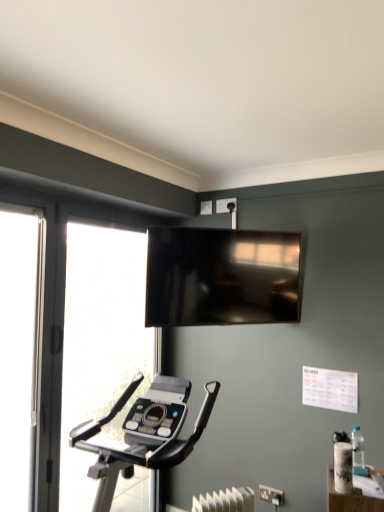
Question: Based on their sizes in the image, would you say white plastic electric outlet at upper center, which appears as the 1th electric outlet when viewed from the top, is bigger or smaller than transparent glass window at left?

Choices:
 (A) big
 (B) small

Answer: (B)

Question: From a real-world perspective, is white plastic electric outlet at upper center, the first electric outlet from the left, physically located above or below transparent glass window at left?

Choices:
 (A) below
 (B) above

Answer: (B)

Question: Which object is positioned farthest from the transparent glass screen door at left?

Choices:
 (A) matte black tv at upper center
 (B) white plastic electric outlet at upper center, which is the 2th electric outlet from right to left
 (C) white plastic electric outlet at center, the 1th electric outlet from the front
 (D) transparent glass window at left

Answer: (B)

Question: Which is nearer to the white plastic electric outlet at upper center, which is the 2th electric outlet from right to left?

Choices:
 (A) transparent glass window at left
 (B) transparent glass screen door at left
 (C) white plastic electric outlet at center, the 2th electric outlet positioned from the top
 (D) matte black tv at upper center

Answer: (D)